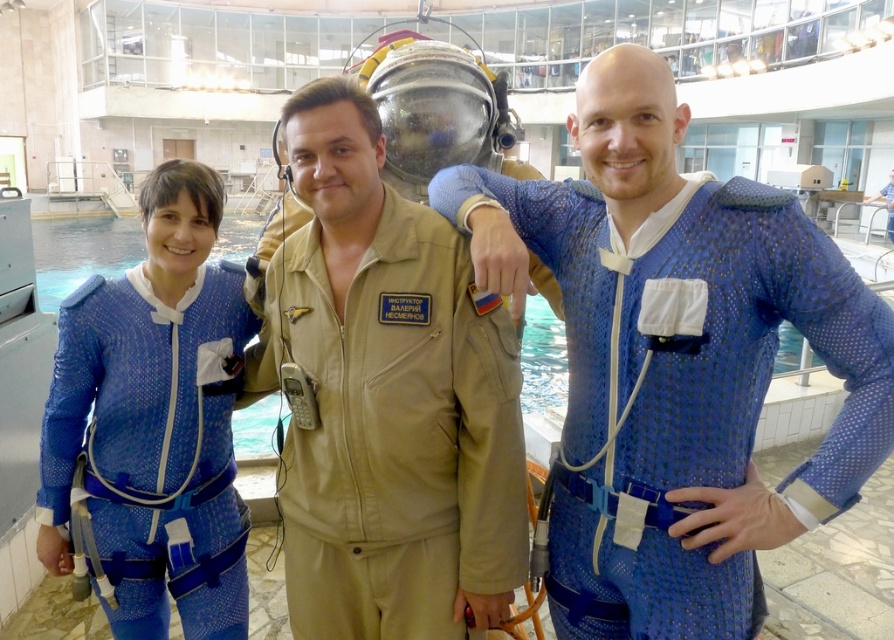
Question: Observing the image, what is the correct spatial positioning of blue textured jumpsuit at center in reference to blue mesh suit at left?

Choices:
 (A) right
 (B) left

Answer: (A)

Question: In this image, where is blue textured jumpsuit at center located relative to tan fabric jumpsuit at center?

Choices:
 (A) below
 (B) above

Answer: (B)

Question: Is blue textured jumpsuit at center positioned behind tan fabric jumpsuit at center?

Choices:
 (A) no
 (B) yes

Answer: (A)

Question: Based on their relative distances, which object is nearer to the blue textured jumpsuit at center?

Choices:
 (A) tan fabric jumpsuit at center
 (B) blue mesh suit at left

Answer: (A)

Question: Which of the following is the farthest from the observer?

Choices:
 (A) [x=299, y=308]
 (B) [x=135, y=593]

Answer: (B)

Question: Which point appears closest to the camera in this image?

Choices:
 (A) (260, 280)
 (B) (136, 536)
 (C) (554, 493)

Answer: (C)